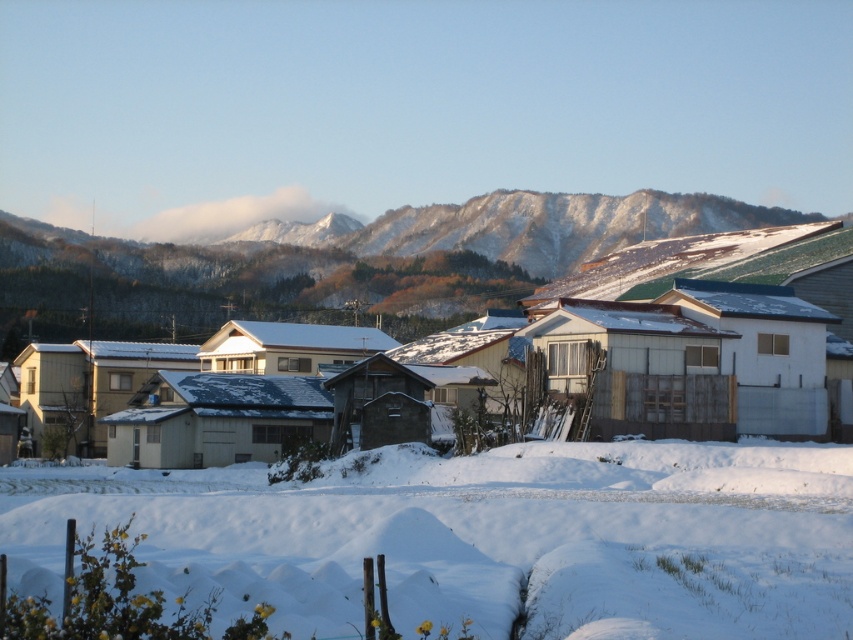
Does white fluffy snow at center appear over snowy mountain at upper center?

Actually, white fluffy snow at center is below snowy mountain at upper center.

Is point (158, 481) closer to viewer compared to point (90, 240)?

That is True.

Find the location of a particular element. white fluffy snow at center is located at coordinates (482, 536).